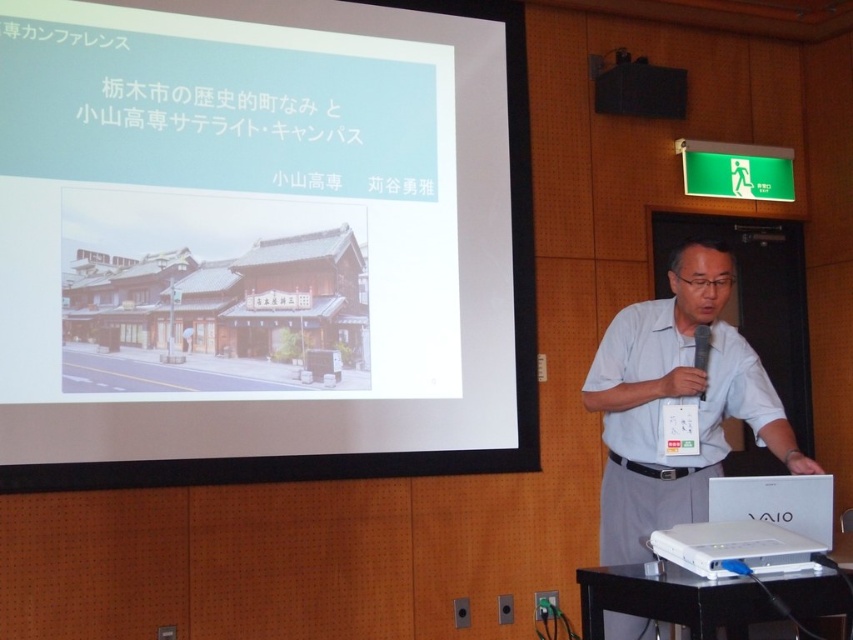
Question: Which object is the farthest from the black plastic podium at lower right?

Choices:
 (A) white matte shirt at center
 (B) white plastic projector at lower right
 (C) white matte projection screen at upper center

Answer: (C)

Question: Which object appears closest to the camera in this image?

Choices:
 (A) black plastic podium at lower right
 (B) white matte projection screen at upper center
 (C) white plastic projector at lower right
 (D) white glossy laptop at upper center

Answer: (A)

Question: From the image, what is the correct spatial relationship of black plastic podium at lower right in relation to white plastic projector at lower right?

Choices:
 (A) left
 (B) right

Answer: (A)

Question: Which object is the farthest from the white matte shirt at center?

Choices:
 (A) white matte projection screen at upper center
 (B) white plastic projector at lower right
 (C) black plastic podium at lower right
 (D) white glossy laptop at upper center

Answer: (D)

Question: Does black plastic podium at lower right have a larger size compared to white plastic projector at lower right?

Choices:
 (A) yes
 (B) no

Answer: (A)

Question: Can you confirm if white matte shirt at center is positioned to the left of white plastic projector at lower right?

Choices:
 (A) yes
 (B) no

Answer: (A)